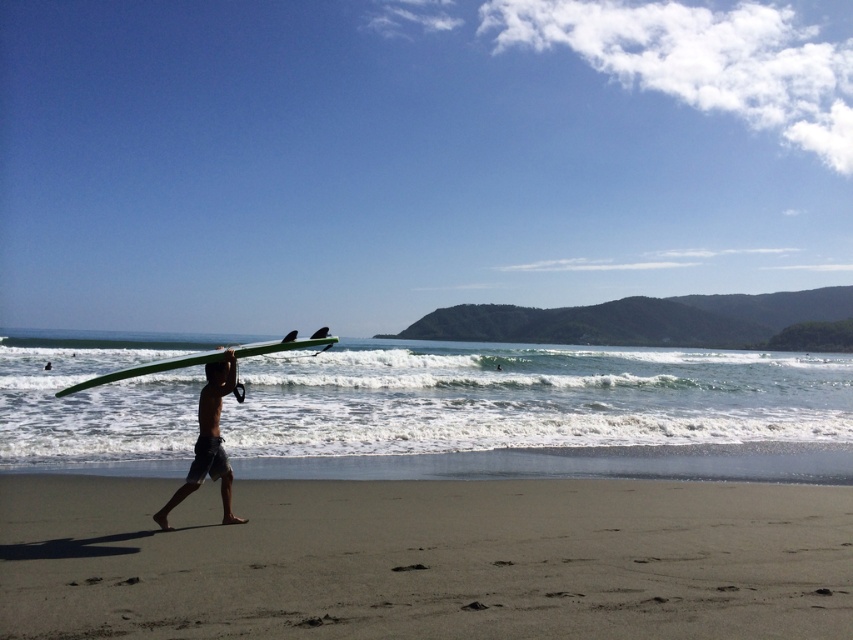
You are standing on the beach and see two points marked on the sand. The first point is at coordinates point (236,396) and the second is at point (209,371). Which point is closer to you?

Point (209,371) is closer to you because it is less further to the camera than point (236,396).

You are standing at the point with coordinates point (228, 385) and want to walk towards the ocean. Is the point point (257, 566) in your way?

Point (257, 566) is in front of point (228, 385), so yes, the point (257, 566) is in your way as you walk towards the ocean.

You are a photographer trying to capture the person with both the green matte surfboard at center and the matte black surfboard at center in your shot. Since you want to highlight the one that is nearer, which surfboard should you focus on?

The green matte surfboard at center is closer to the viewer than the matte black surfboard at center, so you should focus on the green matte surfboard at center to highlight the one that is nearer.